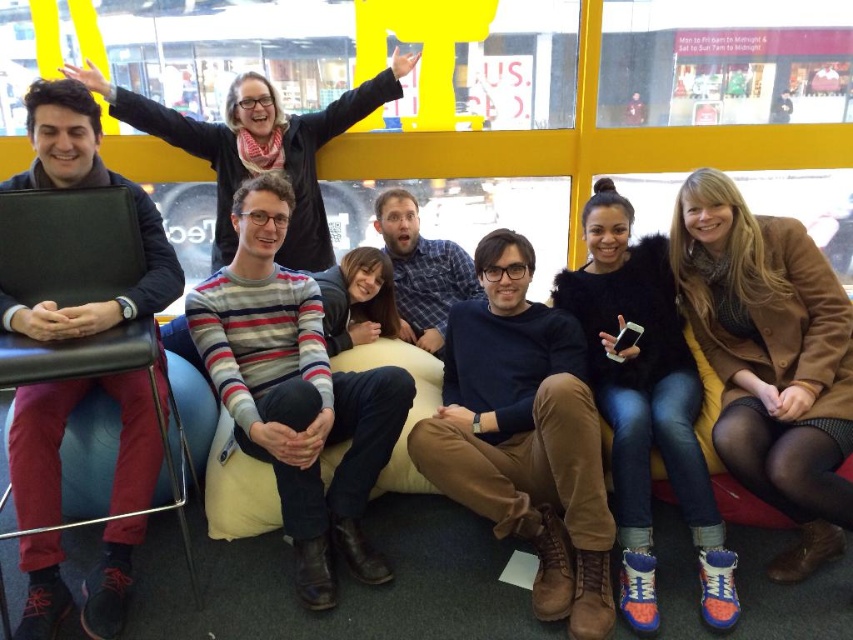
You are organizing a photo shoot and need to ensure that all items in the scene are visible. The denim jeans at lower right and the matte black laptop at left are both important. Since space is limited, which item takes up more horizontal space and might need to be moved first?

The matte black laptop at left takes up more horizontal space than the denim jeans at lower right, so it might need to be moved first to ensure both items are visible.

You are standing in the back row of the group and want to wave to someone in the front row. If you raise your arms and position yourself at point (312,324), will your gesture be visible to the person at point (106,355)?

Yes, because point (106,355) is in front of point (312,324), so the person at point (106,355) will be able to see your gesture from behind.

You are a person who is 14 inches tall and want to sit on the black leather chair at left. There is a striped sweater at center on the seat. Can you sit there without the sweater getting in your way?

The black leather chair at left is 14.30 inches from the striped sweater at center. Since you are 14 inches tall, the distance between you and the sweater is just enough, but the sweater is on the seat, so you would need to move it to sit comfortably.